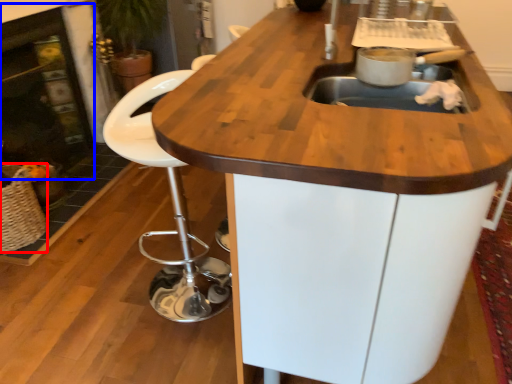
Question: Which of the following is the closest to the observer, basket (highlighted by a red box) or fireplace (highlighted by a blue box)?

Choices:
 (A) basket
 (B) fireplace

Answer: (A)